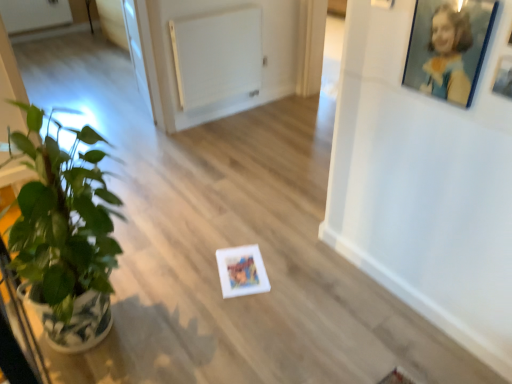
Identify the location of vacant area situated below green glossy houseplant at left (from a real-world perspective). (116, 323).